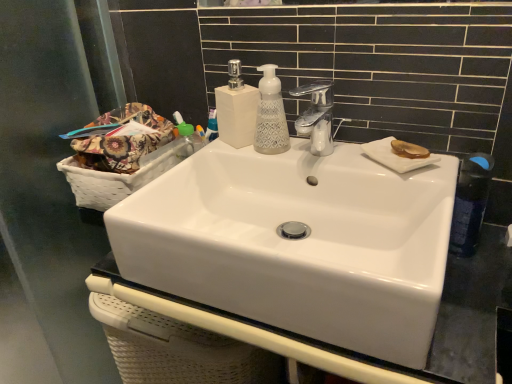
Question: Should I look upward or downward to see translucent amber plate at upper right?

Choices:
 (A) up
 (B) down

Answer: (A)

Question: Does white woven basket at left have a smaller size compared to transparent glass screen door at left?

Choices:
 (A) no
 (B) yes

Answer: (B)

Question: Are white woven basket at left and transparent glass screen door at left located far from each other?

Choices:
 (A) yes
 (B) no

Answer: (B)

Question: Is white woven basket at left not inside transparent glass screen door at left?

Choices:
 (A) no
 (B) yes

Answer: (B)

Question: From a real-world perspective, is white woven basket at left positioned over transparent glass screen door at left based on gravity?

Choices:
 (A) no
 (B) yes

Answer: (B)

Question: Are white woven basket at left and transparent glass screen door at left beside each other?

Choices:
 (A) yes
 (B) no

Answer: (B)

Question: Does white woven basket at left have a greater height compared to transparent glass screen door at left?

Choices:
 (A) yes
 (B) no

Answer: (B)

Question: Is floral fabric basket at left positioned before white matte soap dispenser at center, which is the second soap dispenser from right to left?

Choices:
 (A) yes
 (B) no

Answer: (A)

Question: Is floral fabric basket at left thinner than white matte soap dispenser at center, which is the second soap dispenser from right to left?

Choices:
 (A) yes
 (B) no

Answer: (B)

Question: Can you confirm if floral fabric basket at left is bigger than white matte soap dispenser at center, arranged as the 1th soap dispenser when viewed from the left?

Choices:
 (A) yes
 (B) no

Answer: (A)

Question: Is floral fabric basket at left outside white matte soap dispenser at center, which is the second soap dispenser from right to left?

Choices:
 (A) no
 (B) yes

Answer: (B)

Question: Can you confirm if floral fabric basket at left is wider than white matte soap dispenser at center, arranged as the 1th soap dispenser when viewed from the left?

Choices:
 (A) no
 (B) yes

Answer: (B)

Question: Would you say floral fabric basket at left contains white matte soap dispenser at center, which is the second soap dispenser from right to left?

Choices:
 (A) no
 (B) yes

Answer: (A)

Question: Could you tell me if transparent glass screen door at left is turned towards blue plastic mouthwash at upper center?

Choices:
 (A) no
 (B) yes

Answer: (B)